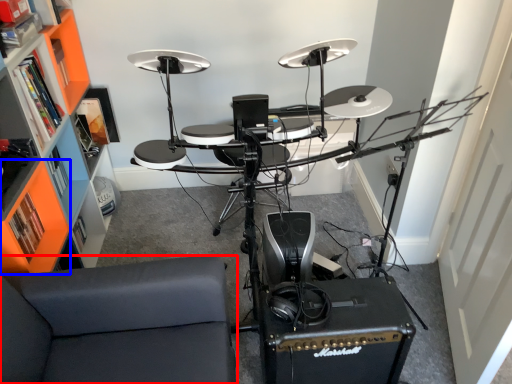
Question: Which of the following is the farthest to the observer, furniture (highlighted by a red box) or shelf (highlighted by a blue box)?

Choices:
 (A) furniture
 (B) shelf

Answer: (B)